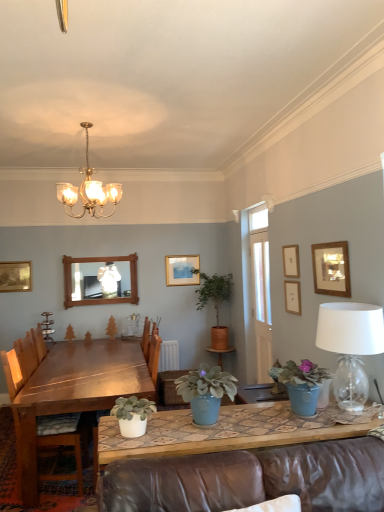
Question: Is green matte plant at center, the second plant when ordered from right to left, behind wooden chair at left?

Choices:
 (A) no
 (B) yes

Answer: (B)

Question: Can you confirm if green matte plant at center, the 1th plant viewed from the left, is smaller than wooden chair at left?

Choices:
 (A) no
 (B) yes

Answer: (B)

Question: Is green matte plant at center, the 2th plant positioned from the back, thinner than wooden chair at left?

Choices:
 (A) yes
 (B) no

Answer: (A)

Question: Can you confirm if green matte plant at center, which is the first plant in front-to-back order, is taller than wooden chair at left?

Choices:
 (A) yes
 (B) no

Answer: (B)

Question: From the image's perspective, is green matte plant at center, the second plant when ordered from right to left, above wooden chair at left?

Choices:
 (A) yes
 (B) no

Answer: (A)

Question: Considering their positions, is clear glass lampshade at right located in front of or behind wooden mirror at upper center?

Choices:
 (A) behind
 (B) front

Answer: (B)

Question: Considering the positions of clear glass lampshade at right and wooden mirror at upper center in the image, is clear glass lampshade at right taller or shorter than wooden mirror at upper center?

Choices:
 (A) tall
 (B) short

Answer: (B)

Question: Is point (347, 380) closer or farther from the camera than point (130, 287)?

Choices:
 (A) closer
 (B) farther

Answer: (A)

Question: Is clear glass lampshade at right to the left or to the right of wooden mirror at upper center in the image?

Choices:
 (A) left
 (B) right

Answer: (B)

Question: Is point (64, 283) positioned closer to the camera than point (26, 364)?

Choices:
 (A) closer
 (B) farther

Answer: (B)

Question: From the image's perspective, is wooden mirror at upper center located above or below wooden chair at left?

Choices:
 (A) below
 (B) above

Answer: (B)

Question: Is wooden mirror at upper center taller or shorter than wooden chair at left?

Choices:
 (A) short
 (B) tall

Answer: (A)

Question: Looking at their shapes, would you say wooden mirror at upper center is wider or thinner than wooden chair at left?

Choices:
 (A) wide
 (B) thin

Answer: (B)

Question: From the image's perspective, is wooden chair at left above or below green matte plant at center, the first plant in the right-to-left sequence?

Choices:
 (A) below
 (B) above

Answer: (A)

Question: Considering their positions, is wooden chair at left located in front of or behind green matte plant at center, the first plant in the right-to-left sequence?

Choices:
 (A) front
 (B) behind

Answer: (A)